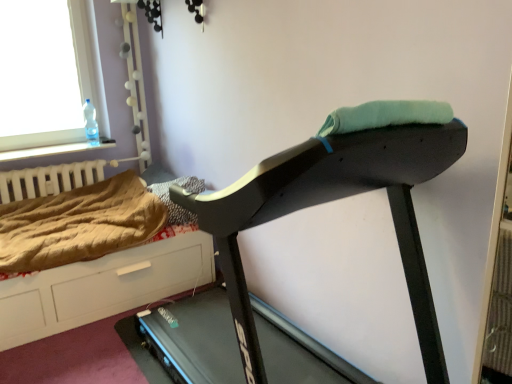
Where is `brown wood dresser at lower left`? brown wood dresser at lower left is located at coordinates pyautogui.click(x=102, y=287).

Looking at this image, measure the distance between brown textured blanket at left, placed as the second blanket when sorted from right to left, and camera.

brown textured blanket at left, placed as the second blanket when sorted from right to left, is 2.15 meters from camera.

In order to face black plastic treadmill at center, should I rotate leftwards or rightwards?

You should rotate left by 0.777 degrees.

At what (x,y) coordinates should I click in order to perform the action: click on white matte radiator at left. Please return your answer as a coordinate pair (x, y). This screenshot has height=384, width=512. Looking at the image, I should click on (49, 180).

Is point (133, 270) positioned behind point (105, 163)?

No.

Is brown wood dresser at lower left situated inside white matte radiator at left or outside?

brown wood dresser at lower left cannot be found inside white matte radiator at left.

Is brown wood dresser at lower left positioned with its back to white matte radiator at left?

Absolutely, brown wood dresser at lower left is directed away from white matte radiator at left.

In terms of height, does brown wood dresser at lower left look taller or shorter compared to white matte radiator at left?

Clearly, brown wood dresser at lower left is taller compared to white matte radiator at left.

Is brown wood dresser at lower left facing towards transparent glass window at upper left?

No, brown wood dresser at lower left is not turned towards transparent glass window at upper left.

Which of these two, brown wood dresser at lower left or transparent glass window at upper left, stands shorter?

brown wood dresser at lower left.

Locate an element on the screen. The image size is (512, 384). window behind the brown wood dresser at lower left is located at coordinates (89, 59).

At what (x,y) coordinates should I click in order to perform the action: click on radiator above the brown textured blanket at center, which appears as the first blanket when viewed from the right (from the image's perspective). Please return your answer as a coordinate pair (x, y). This screenshot has width=512, height=384. Looking at the image, I should click on (49, 180).

Is brown textured blanket at center, which appears as the first blanket when viewed from the right, with white matte radiator at left?

There is a gap between brown textured blanket at center, which appears as the first blanket when viewed from the right, and white matte radiator at left.

Can you tell me how much brown textured blanket at center, which appears as the first blanket when viewed from the right, and white matte radiator at left differ in facing direction?

91.2 degrees.

Considering the relative sizes of brown textured blanket at center, which appears as the first blanket when viewed from the right, and white matte radiator at left in the image provided, is brown textured blanket at center, which appears as the first blanket when viewed from the right, taller than white matte radiator at left?

No, brown textured blanket at center, which appears as the first blanket when viewed from the right, is not taller than white matte radiator at left.

From the image's perspective, is brown textured blanket at left, which is counted as the first blanket, starting from the left, below white matte radiator at left?

Yes, from the image's perspective, brown textured blanket at left, which is counted as the first blanket, starting from the left, is beneath white matte radiator at left.

From a real-world perspective, is brown textured blanket at left, placed as the second blanket when sorted from right to left, physically below white matte radiator at left?

Yes, from a real-world perspective, brown textured blanket at left, placed as the second blanket when sorted from right to left, is beneath white matte radiator at left.

Considering the points (29, 242) and (80, 173), which point is in front, point (29, 242) or point (80, 173)?

Positioned in front is point (29, 242).

Is the position of brown textured blanket at left, which is counted as the first blanket, starting from the left, less distant than that of white matte radiator at left?

That is True.

Who is bigger, brown textured blanket at left, which is counted as the first blanket, starting from the left, or brown textured blanket at center, which is the second blanket from left to right?

Bigger between the two is brown textured blanket at left, which is counted as the first blanket, starting from the left.

From the image's perspective, does brown textured blanket at left, placed as the second blanket when sorted from right to left, appear lower than brown textured blanket at center, which appears as the first blanket when viewed from the right?

Correct, brown textured blanket at left, placed as the second blanket when sorted from right to left, appears lower than brown textured blanket at center, which appears as the first blanket when viewed from the right, in the image.

From a real-world perspective, who is located lower, brown textured blanket at left, placed as the second blanket when sorted from right to left, or brown textured blanket at center, which is the second blanket from left to right?

From a 3D spatial view, brown textured blanket at left, placed as the second blanket when sorted from right to left, is below.

Considering the relative sizes of brown textured blanket at left, placed as the second blanket when sorted from right to left, and brown textured blanket at center, which is the second blanket from left to right, in the image provided, is brown textured blanket at left, placed as the second blanket when sorted from right to left, wider than brown textured blanket at center, which is the second blanket from left to right,?

Indeed, brown textured blanket at left, placed as the second blanket when sorted from right to left, has a greater width compared to brown textured blanket at center, which is the second blanket from left to right.

In the scene shown: Is brown textured blanket at center, which appears as the first blanket when viewed from the right, inside the boundaries of black plastic treadmill at center, or outside?

brown textured blanket at center, which appears as the first blanket when viewed from the right, is located beyond the bounds of black plastic treadmill at center.

How many degrees apart are the facing directions of brown textured blanket at center, which appears as the first blanket when viewed from the right, and black plastic treadmill at center?

The facing directions of brown textured blanket at center, which appears as the first blanket when viewed from the right, and black plastic treadmill at center are 1.35 degrees apart.

Is point (182, 218) less distant than point (307, 162)?

No, (182, 218) is behind (307, 162).

Is brown textured blanket at center, which appears as the first blanket when viewed from the right, next to black plastic treadmill at center?

No, brown textured blanket at center, which appears as the first blanket when viewed from the right, is not in contact with black plastic treadmill at center.

Consider the image. Is black plastic treadmill at center closer to camera compared to white matte radiator at left?

Yes, black plastic treadmill at center is in front of white matte radiator at left.

From the image's perspective, between black plastic treadmill at center and white matte radiator at left, who is located below?

From the image's view, black plastic treadmill at center is below.

What's the angular difference between black plastic treadmill at center and white matte radiator at left's facing directions?

black plastic treadmill at center and white matte radiator at left are facing 89.8 degrees away from each other.

In the scene shown: Is white matte radiator at left a part of black plastic treadmill at center?

No, white matte radiator at left is not inside black plastic treadmill at center.

Locate an element on the screen. dresser below the white matte radiator at left (from the image's perspective) is located at coordinates (102, 287).

You are a GUI agent. You are given a task and a screenshot of the screen. Output one action in this format:
    pyautogui.click(x=<x>, y=<y>)
    Task: Click on the window that appears above the brown wood dresser at lower left (from the image's perspective)
    
    Given the screenshot: What is the action you would take?
    coord(89,59)

Considering their positions, is white matte radiator at left positioned further to transparent glass window at upper left than brown textured blanket at center, which is the second blanket from left to right?

Among the two, brown textured blanket at center, which is the second blanket from left to right, is located further to transparent glass window at upper left.

Looking at the image, which one is located closer to brown textured blanket at center, which is the second blanket from left to right, brown textured blanket at left, which is counted as the first blanket, starting from the left, or brown wood dresser at lower left?

brown textured blanket at left, which is counted as the first blanket, starting from the left, is closer to brown textured blanket at center, which is the second blanket from left to right.

When comparing their distances from brown textured blanket at left, which is counted as the first blanket, starting from the left, does transparent glass window at upper left or white matte radiator at left seem further?

Among the two, transparent glass window at upper left is located further to brown textured blanket at left, which is counted as the first blanket, starting from the left.

In the scene shown: Which object lies further to the anchor point black plastic treadmill at center, brown wood dresser at lower left or transparent glass window at upper left?

transparent glass window at upper left.

Looking at this image, which object lies further to the anchor point black plastic treadmill at center, brown textured blanket at left, which is counted as the first blanket, starting from the left, or transparent glass window at upper left?

transparent glass window at upper left lies further to black plastic treadmill at center than the other object.

From the image, which object appears to be farther from brown textured blanket at center, which appears as the first blanket when viewed from the right, brown textured blanket at left, placed as the second blanket when sorted from right to left, or transparent glass window at upper left?

transparent glass window at upper left is positioned further to the anchor brown textured blanket at center, which appears as the first blanket when viewed from the right.

Estimate the real-world distances between objects in this image. Which object is closer to brown textured blanket at center, which appears as the first blanket when viewed from the right, brown textured blanket at left, placed as the second blanket when sorted from right to left, or white matte radiator at left?

brown textured blanket at left, placed as the second blanket when sorted from right to left, is positioned closer to the anchor brown textured blanket at center, which appears as the first blanket when viewed from the right.

Looking at the image, which one is located closer to brown wood dresser at lower left, white matte radiator at left or brown textured blanket at left, which is counted as the first blanket, starting from the left?

brown textured blanket at left, which is counted as the first blanket, starting from the left, lies closer to brown wood dresser at lower left than the other object.

Identify the location of window between black plastic treadmill at center and white matte radiator at left along the z-axis. (89, 59).

The image size is (512, 384). Find the location of `dresser between black plastic treadmill at center and brown textured blanket at left, which is counted as the first blanket, starting from the left, along the z-axis`. dresser between black plastic treadmill at center and brown textured blanket at left, which is counted as the first blanket, starting from the left, along the z-axis is located at coordinates pyautogui.click(x=102, y=287).

The width and height of the screenshot is (512, 384). In order to click on radiator between transparent glass window at upper left and brown textured blanket at left, which is counted as the first blanket, starting from the left, vertically in this screenshot , I will do `click(49, 180)`.

Locate an element on the screen. The height and width of the screenshot is (384, 512). blanket between white matte radiator at left and brown textured blanket at center, which is the second blanket from left to right is located at coordinates (78, 224).